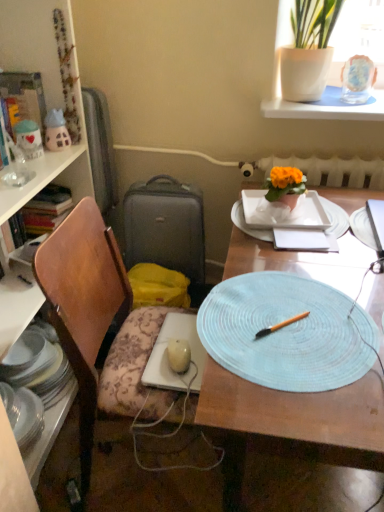
Question: From the image's perspective, is light blue woven placemat at center above or below wooden chair at left?

Choices:
 (A) above
 (B) below

Answer: (B)

Question: Looking at the image, does light blue woven placemat at center seem bigger or smaller compared to wooden chair at left?

Choices:
 (A) big
 (B) small

Answer: (A)

Question: Which is nearer to the white ceramic vase at upper right?

Choices:
 (A) wooden bookcase at left
 (B) white ceramic plate at center, which is the 2th plate from bottom to top
 (C) stacked glass plates at left
 (D) matte gray suitcase at left
 (E) light blue woven placemat at center

Answer: (B)

Question: Estimate the real-world distances between objects in this image. Which object is farther from the matte gray suitcase at left?

Choices:
 (A) stacked glass plates at left
 (B) white ceramic vase at upper right
 (C) white glossy plate at left, arranged as the 2th plate when viewed from the top
 (D) white ceramic plate at center, the first plate in the right-to-left sequence
 (E) light blue woven placemat at center

Answer: (C)